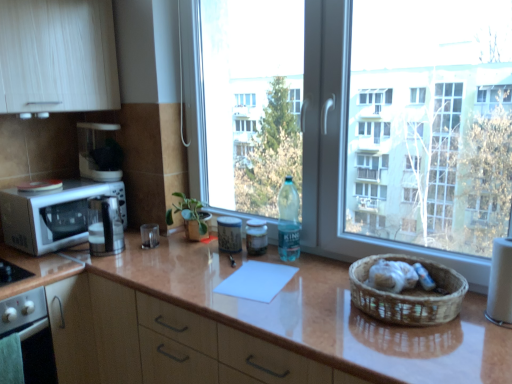
Question: From a real-world perspective, is glossy brown countertop at center physically below matte white coffee maker at upper left, the 1th appliance viewed from the back?

Choices:
 (A) yes
 (B) no

Answer: (A)

Question: Is glossy brown countertop at center not close to matte white coffee maker at upper left, which is the 4th appliance in bottom-to-top order?

Choices:
 (A) yes
 (B) no

Answer: (B)

Question: Considering the relative sizes of glossy brown countertop at center and matte white coffee maker at upper left, the first appliance positioned from the left, in the image provided, is glossy brown countertop at center wider than matte white coffee maker at upper left, the first appliance positioned from the left,?

Choices:
 (A) yes
 (B) no

Answer: (A)

Question: Considering the relative sizes of glossy brown countertop at center and matte white coffee maker at upper left, marked as the fourth appliance in a right-to-left arrangement, in the image provided, is glossy brown countertop at center taller than matte white coffee maker at upper left, marked as the fourth appliance in a right-to-left arrangement,?

Choices:
 (A) yes
 (B) no

Answer: (A)

Question: From a real-world perspective, is glossy brown countertop at center on top of matte white coffee maker at upper left, the 4th appliance in the front-to-back sequence?

Choices:
 (A) yes
 (B) no

Answer: (B)

Question: From the image's perspective, would you say glossy brown countertop at center is positioned over matte white coffee maker at upper left, which is the 4th appliance in bottom-to-top order?

Choices:
 (A) no
 (B) yes

Answer: (A)

Question: Considering the relative sizes of transparent glass window at center and white glossy microwave oven at left in the image provided, is transparent glass window at center thinner than white glossy microwave oven at left?

Choices:
 (A) no
 (B) yes

Answer: (B)

Question: Is transparent glass window at center positioned far away from white glossy microwave oven at left?

Choices:
 (A) yes
 (B) no

Answer: (B)

Question: Is the depth of transparent glass window at center less than that of white glossy microwave oven at left?

Choices:
 (A) no
 (B) yes

Answer: (B)

Question: Considering the relative positions of transparent glass window at center and white glossy microwave oven at left in the image provided, is transparent glass window at center to the right of white glossy microwave oven at left from the viewer's perspective?

Choices:
 (A) no
 (B) yes

Answer: (B)

Question: From the image's perspective, does transparent glass window at center appear higher than white glossy microwave oven at left?

Choices:
 (A) no
 (B) yes

Answer: (B)

Question: Considering the relative sizes of transparent glass window at center and white glossy microwave oven at left in the image provided, is transparent glass window at center taller than white glossy microwave oven at left?

Choices:
 (A) yes
 (B) no

Answer: (A)

Question: Is white paper towel at right, arranged as the 1th appliance when viewed from the front, next to satin silver coffee machine at center and touching it?

Choices:
 (A) yes
 (B) no

Answer: (B)